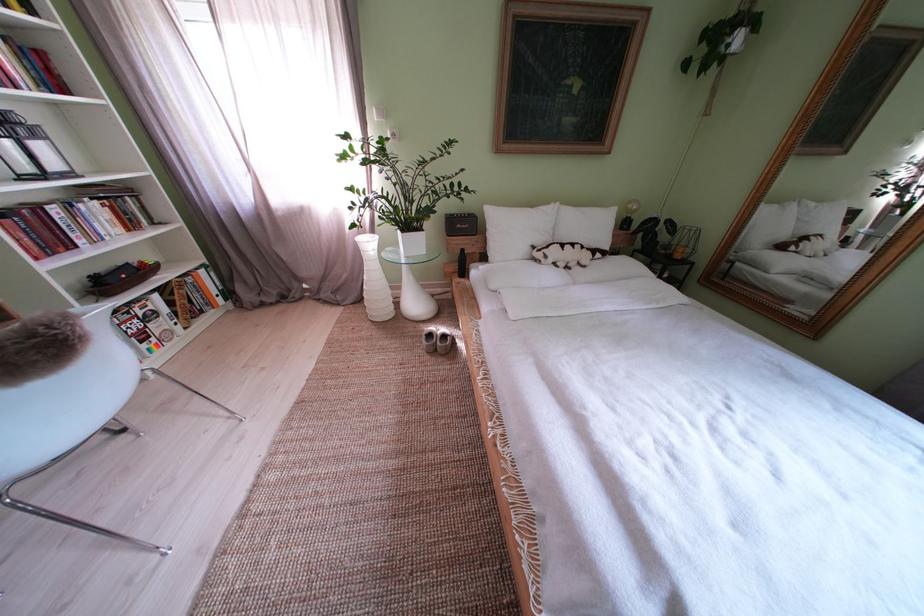
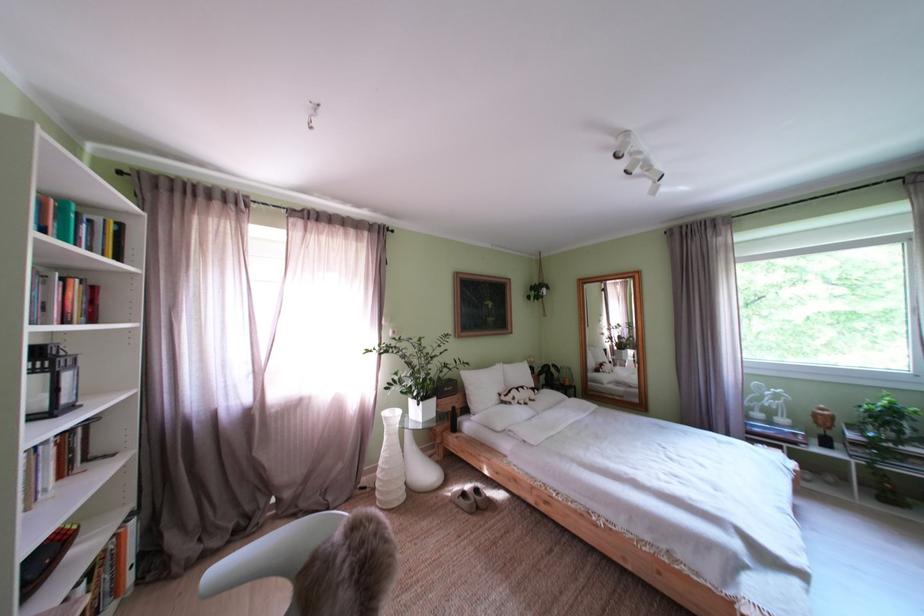
Find the pixel in the second image that matches point (594, 268) in the first image.

(543, 403)